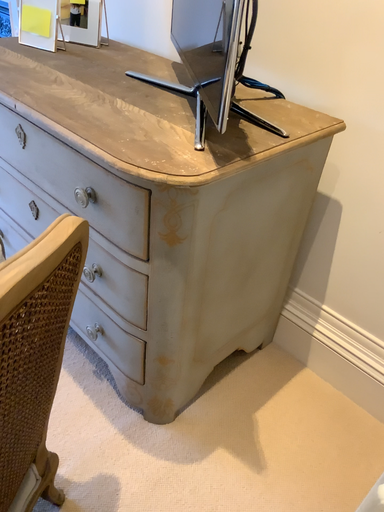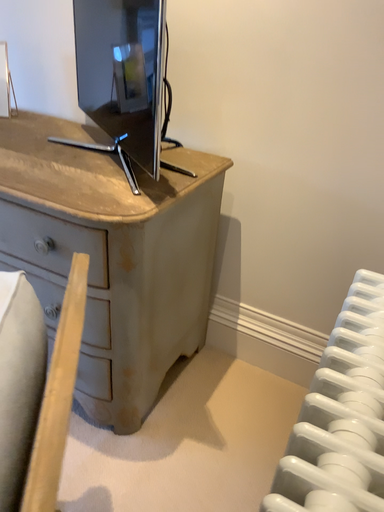
Question: How did the camera likely rotate when shooting the video?

Choices:
 (A) rotated left
 (B) rotated right

Answer: (B)